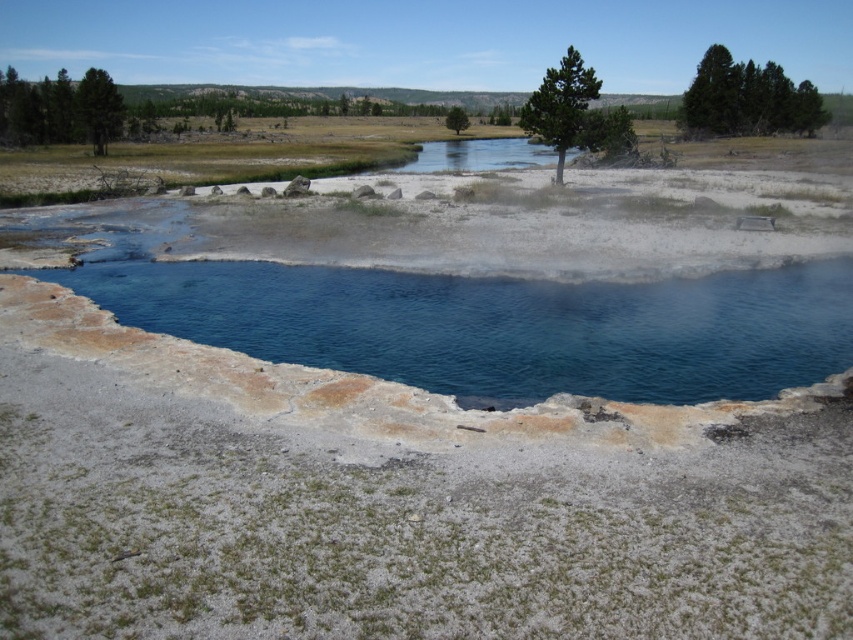
Question: Is green coniferous trees at upper right positioned before green textured pine tree at upper right?

Choices:
 (A) yes
 (B) no

Answer: (B)

Question: Among these objects, which one is nearest to the camera?

Choices:
 (A) green leafy tree at center
 (B) blue clear water at center

Answer: (B)

Question: Which point is farther to the camera?

Choices:
 (A) green coniferous trees at upper right
 (B) blue clear water at center
 (C) green textured pine tree at upper right
 (D) green textured tree at upper left

Answer: (A)

Question: Is the position of blue clear water at center more distant than that of green coniferous trees at upper right?

Choices:
 (A) no
 (B) yes

Answer: (A)

Question: Does green textured tree at upper left appear on the left side of green leafy tree at center?

Choices:
 (A) yes
 (B) no

Answer: (A)

Question: Which object appears farthest from the camera in this image?

Choices:
 (A) green textured tree at upper left
 (B) green textured pine tree at upper right
 (C) green leafy tree at center

Answer: (C)